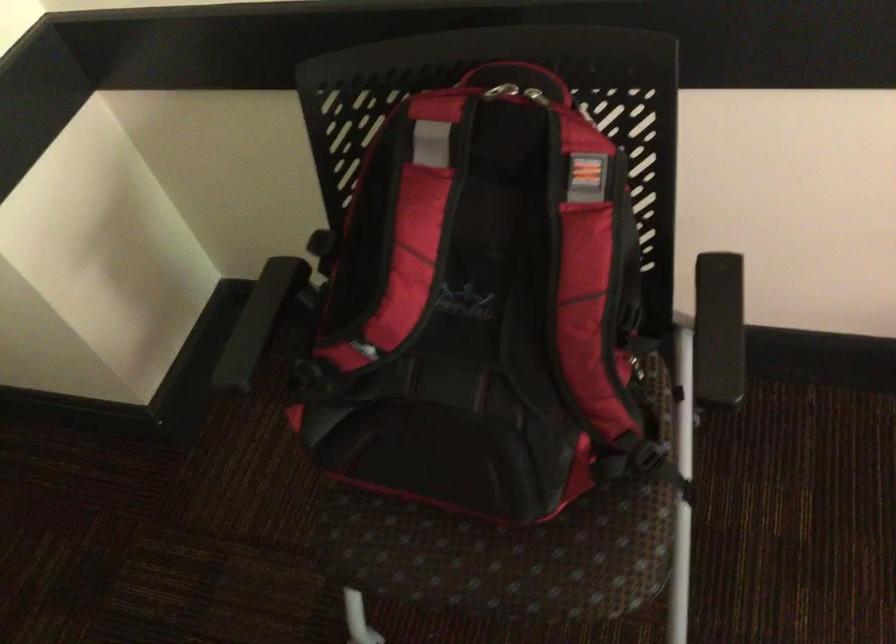
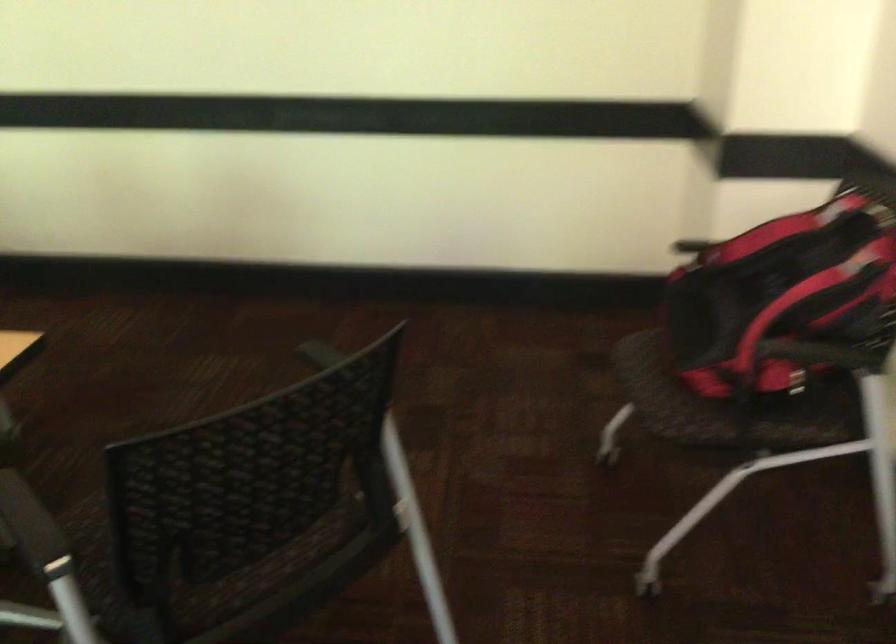
The point at (488, 285) is marked in the first image. Where is the corresponding point in the second image?

(785, 283)